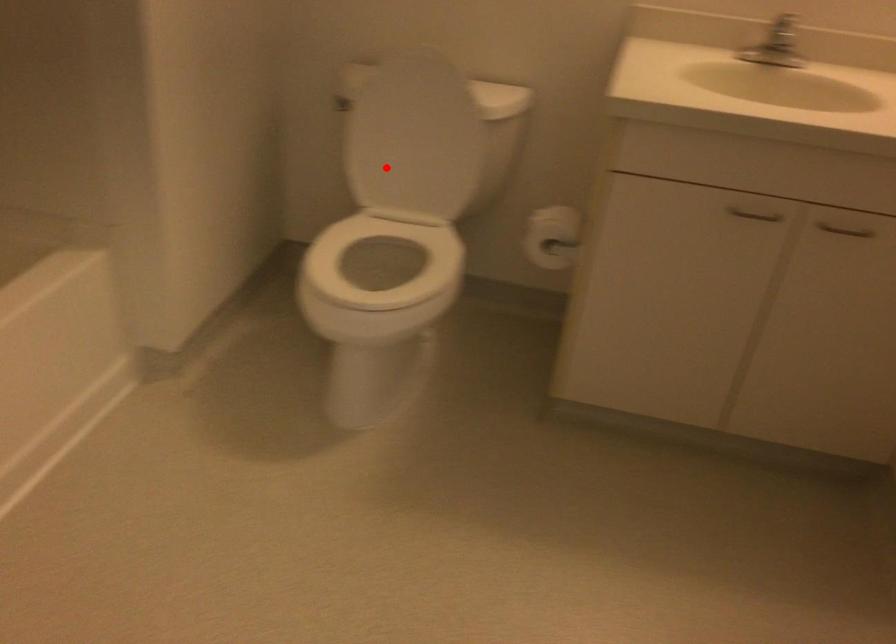
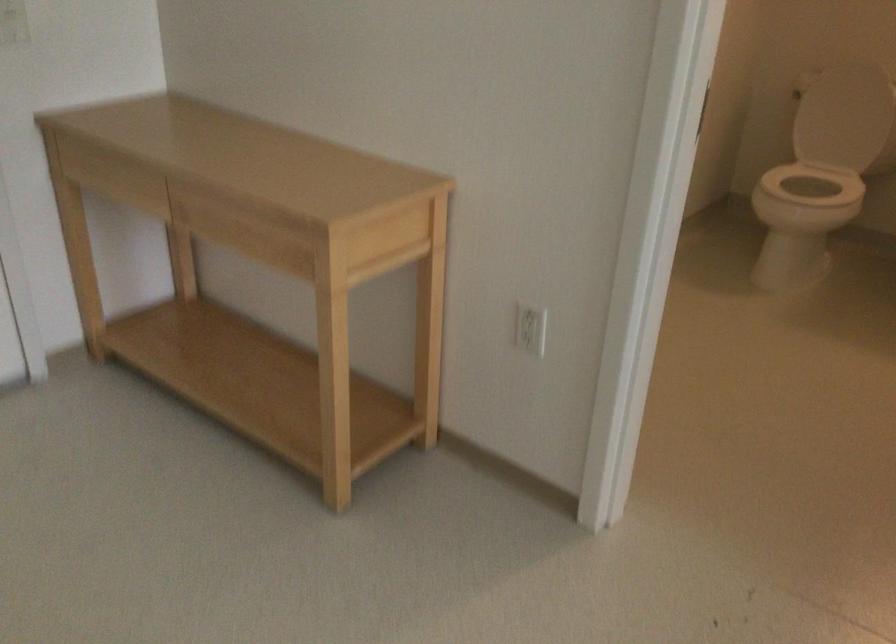
Question: I am providing you with two images of the same scene from different viewpoints. In image1, a red point is highlighted. Considering the same 3D point in image2, which of the following is correct?

Choices:
 (A) It is closer
 (B) It is farther

Answer: (B)